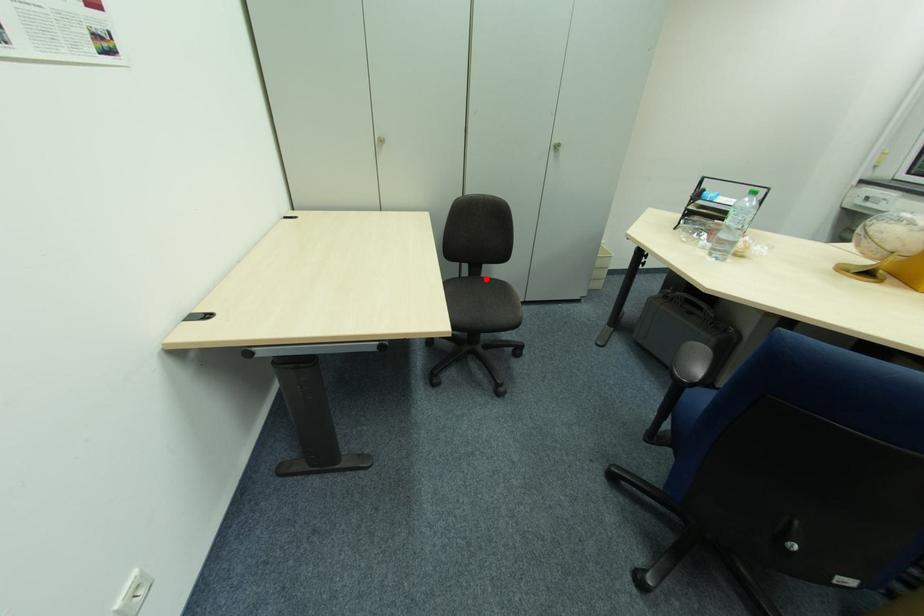
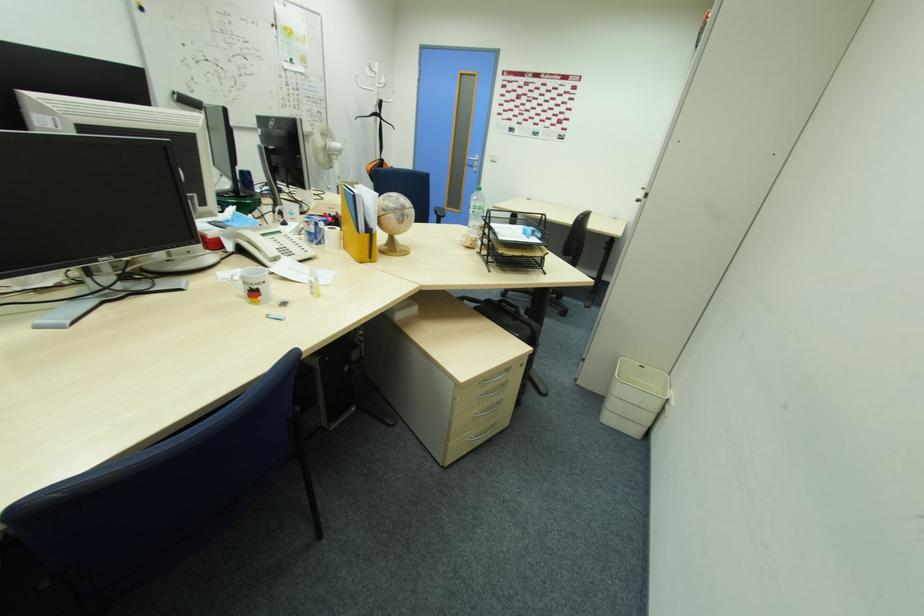
Question: I am providing you with two images of the same scene from different viewpoints. A red point is marked on the first image. Is the red point's position out of view in image 2?

Choices:
 (A) Yes
 (B) No

Answer: (A)